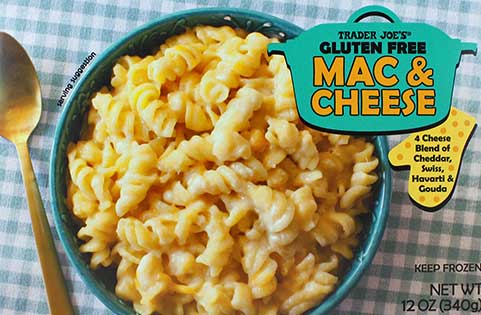
Locate an element on the screen. The width and height of the screenshot is (481, 315). blue bowl is located at coordinates (61, 133).